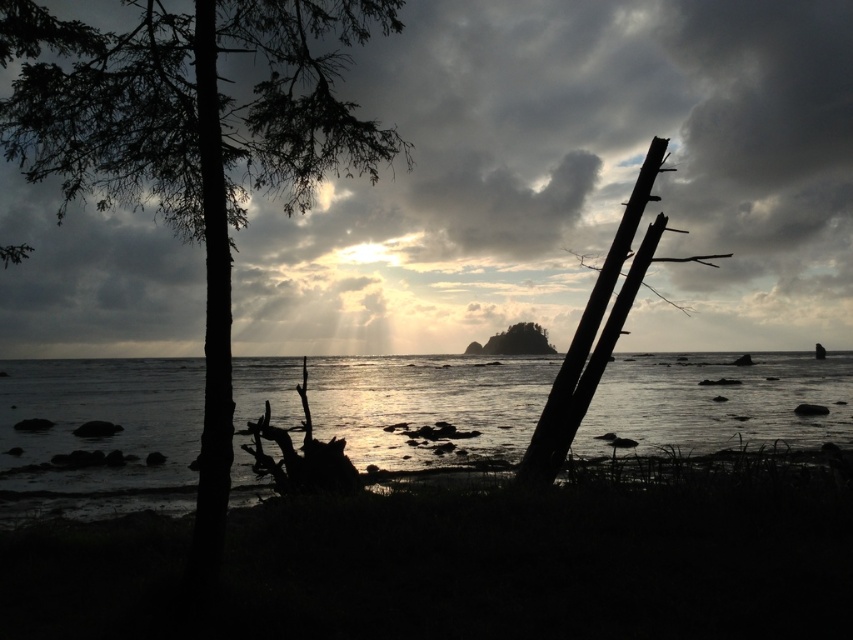
You are standing at the edge of the beach and want to place a small seashell on the highest point between the silvery reflective water at center and the smooth brown rock at center. Which object should you choose?

The smooth brown rock at center has a greater height than the silvery reflective water at center, so you should place the seashell on the smooth brown rock at center.

You are standing at the edge of the coast and see two points marked in the image. The first point is at coordinates point (x=363, y=387) and the second is at point (x=538, y=474). Which point is closer to you?

Point (x=363, y=387) is closer to you because it is further to the viewer than point (x=538, y=474).

You are a photographer trying to capture the sunset reflection on the water. You see the silvery reflective water at center and the dark brown wood pole at right. Which object should you focus on to ensure the reflection of the sunset is visible?

The silvery reflective water at center is positioned on the right side of dark brown wood pole at right. To capture the sunset reflection, focus on the silvery reflective water at center as it is the reflective surface where the sunset would be mirrored.